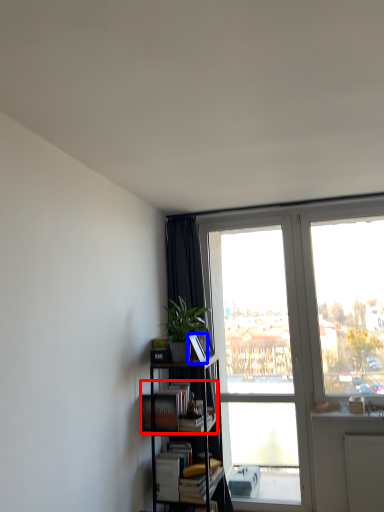
Question: Among these objects, which one is nearest to the camera, book (highlighted by a red box) or paperback book (highlighted by a blue box)?

Choices:
 (A) book
 (B) paperback book

Answer: (A)